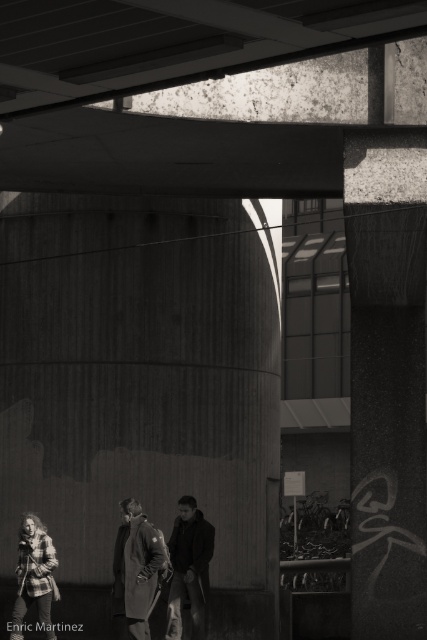
You are a tailor observing the two coats at the center of the image, the coarse wool coat at center and the dark wool coat at center. Which coat is shorter in height?

The coarse wool coat at center is shorter in height compared to the dark wool coat at center.

In the urban scene, there are two people wearing distinct clothing items. One has a dark wool coat at center and another has a plaid flannel shirt at lower left. From the perspective of someone standing in the middle of the scene, which clothing item is positioned to the right?

The dark wool coat at center is to the right of the plaid flannel shirt at lower left.